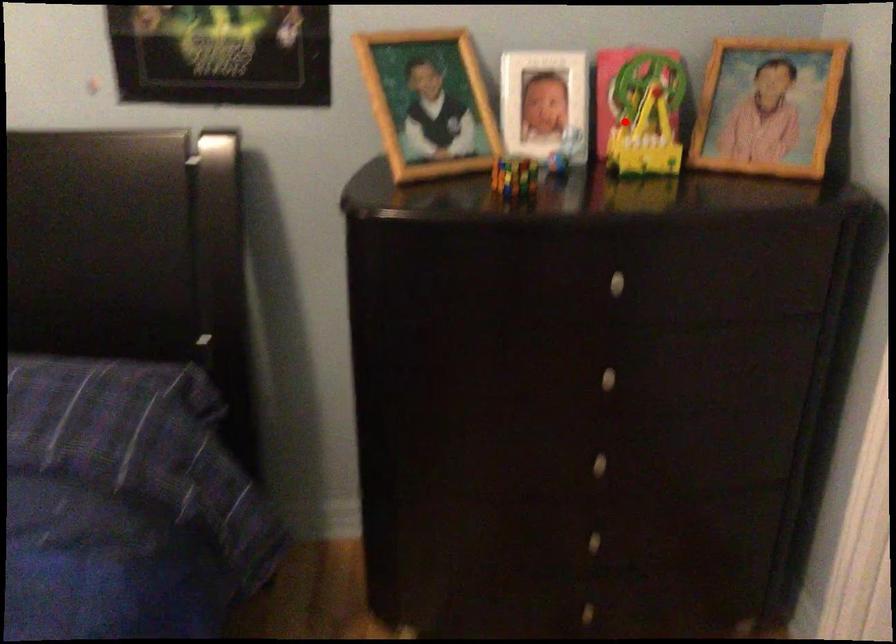
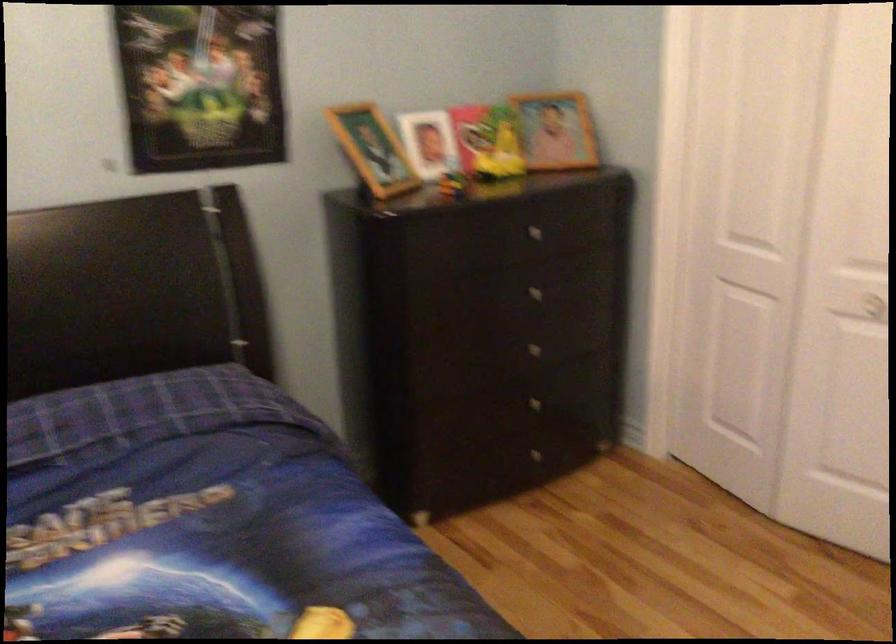
Find the pixel in the second image that matches the highlighted location in the first image.

(487, 142)